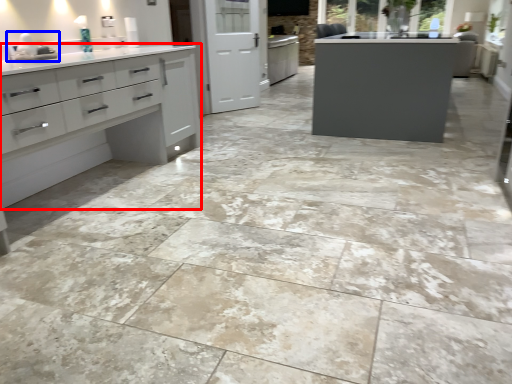
Question: Which point is further to the camera, cupboard (highlighted by a red box) or sink (highlighted by a blue box)?

Choices:
 (A) cupboard
 (B) sink

Answer: (B)